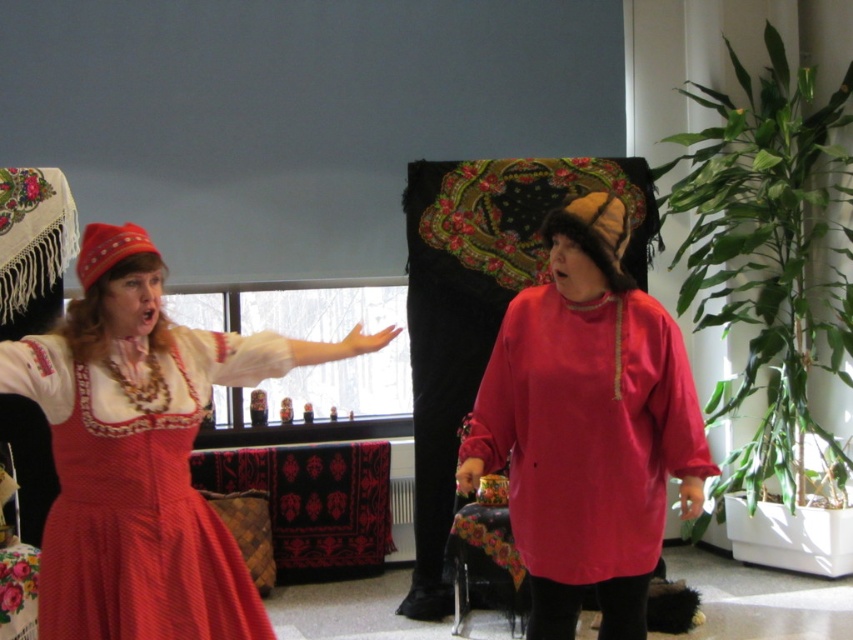
Question: Is matte red blouse at center to the left of matte red dress at left from the viewer's perspective?

Choices:
 (A) no
 (B) yes

Answer: (A)

Question: Does matte red blouse at center have a larger size compared to matte red dress at left?

Choices:
 (A) no
 (B) yes

Answer: (B)

Question: Which of the following is the farthest from the observer?

Choices:
 (A) (608, 320)
 (B) (113, 531)

Answer: (A)

Question: Which of the following is the farthest from the observer?

Choices:
 (A) matte red dress at left
 (B) matte red blouse at center

Answer: (B)

Question: Considering the relative positions of matte red blouse at center and matte red dress at left in the image provided, where is matte red blouse at center located with respect to matte red dress at left?

Choices:
 (A) below
 (B) above

Answer: (B)